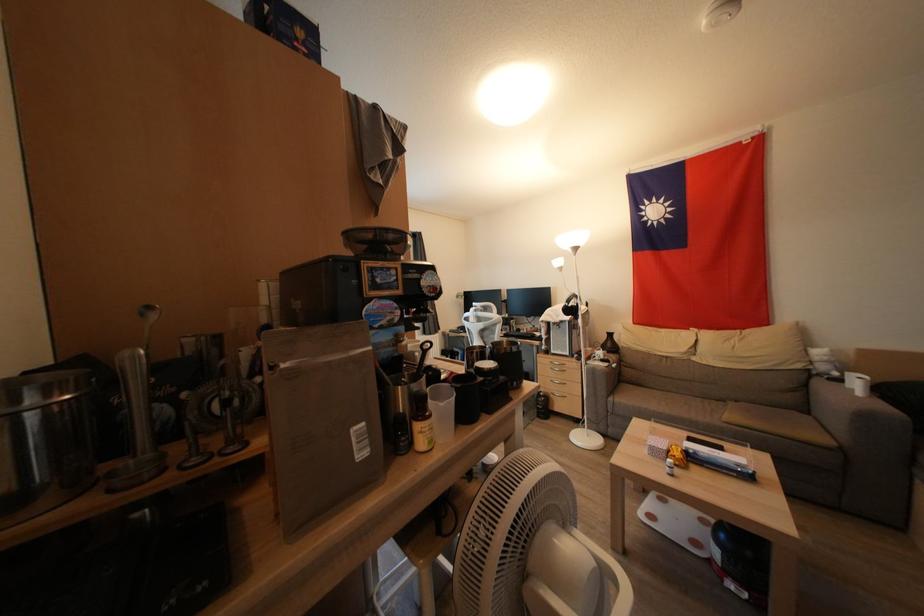
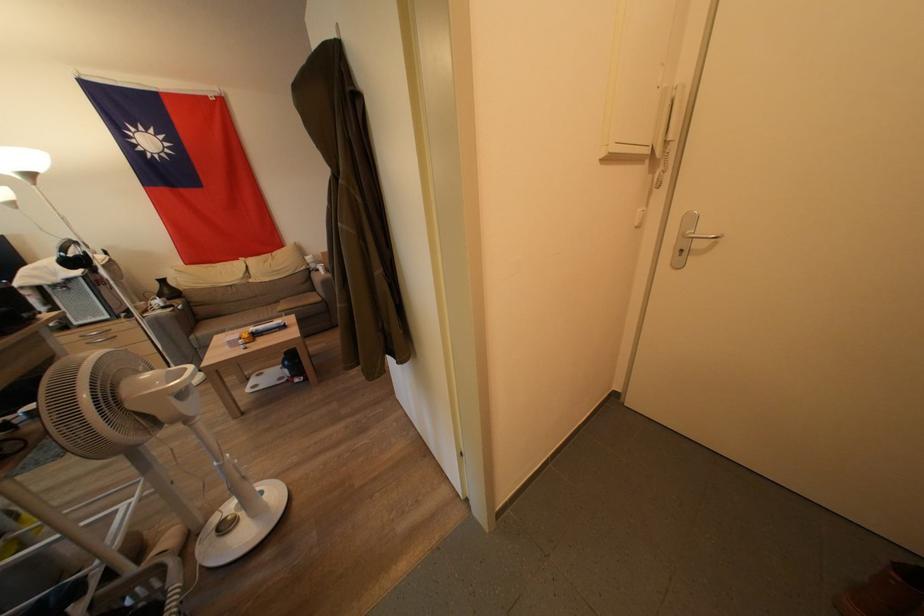
Where in the second image is the point corresponding to (636,371) from the first image?

(207, 309)